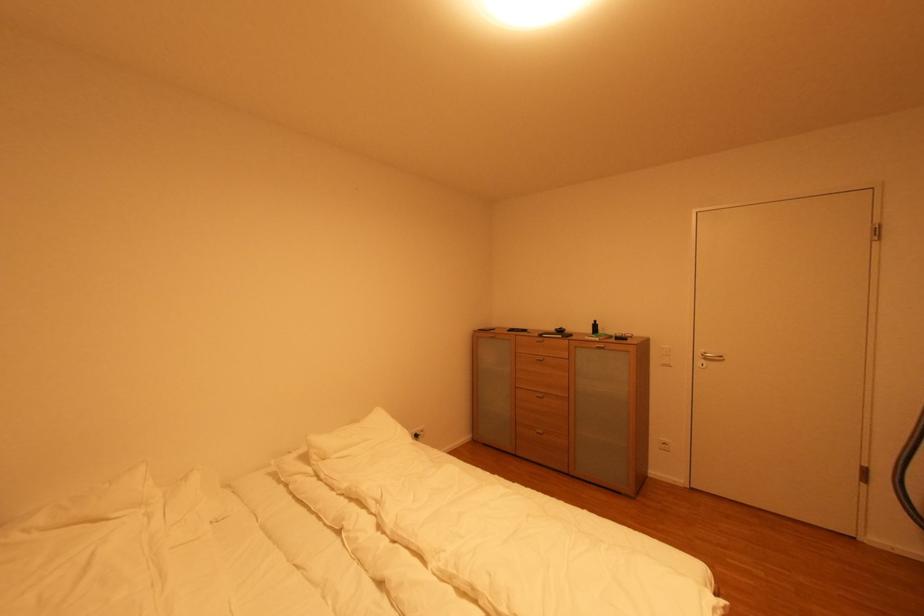
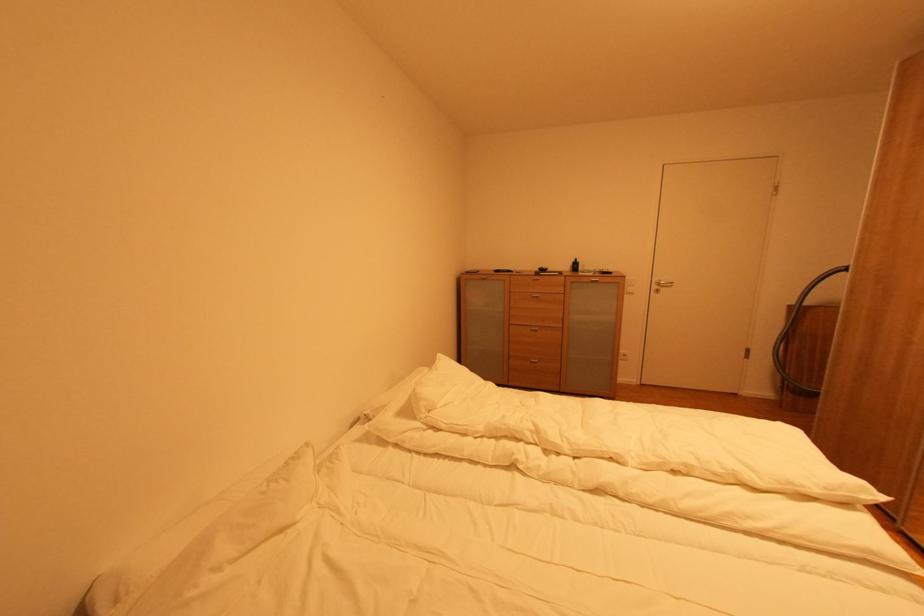
Find the pixel in the second image that matches (x=543, y=398) in the first image.

(539, 331)